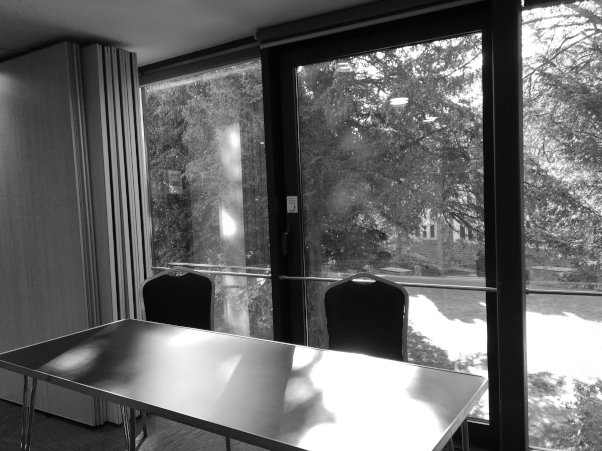
At what (x,y) coordinates should I click in order to perform the action: click on middle door frame. Please return your answer as a coordinate pair (x, y). The width and height of the screenshot is (602, 451). Looking at the image, I should click on (343, 14).